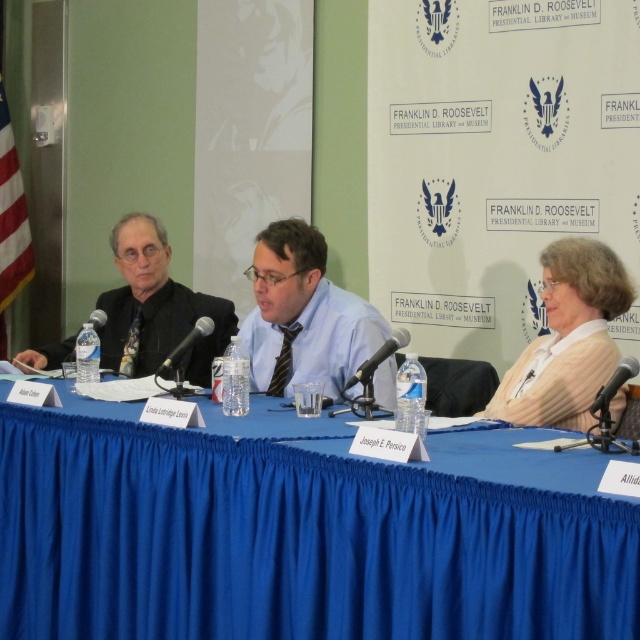
Looking at this image, you are a photographer setting up for a panel discussion at the Franklin D. Roosevelt Presidential Library and Museum. You need to position a camera to capture both the black metallic microphone at center and the black matte microphone at center clearly. What is the minimum distance the camera should be placed from the table to ensure both microphones are in frame?

The black metallic microphone at center is 28.10 inches away from the black matte microphone at center. To capture both microphones clearly, the camera should be positioned at least 28.10 inches away from the table to ensure both are in frame.

You are attending the panel discussion at the Franklin D. Roosevelt Presidential Library and Museum and notice two microphones on the table. Which one is closer to you, the black metallic microphone at center or the black matte microphone at center?

The black metallic microphone at center is closer to the viewer than the black matte microphone at center.